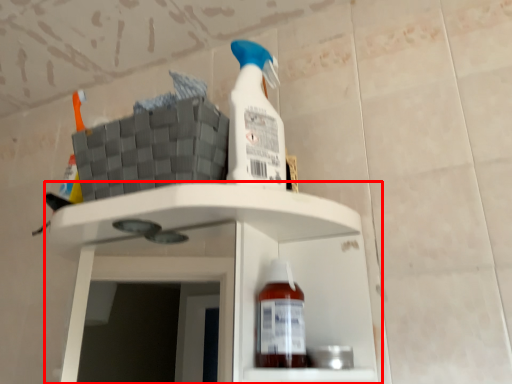
Question: From the image's perspective, what is the correct spatial relationship of shelf (annotated by the red box) in relation to bottle?

Choices:
 (A) below
 (B) above

Answer: (A)